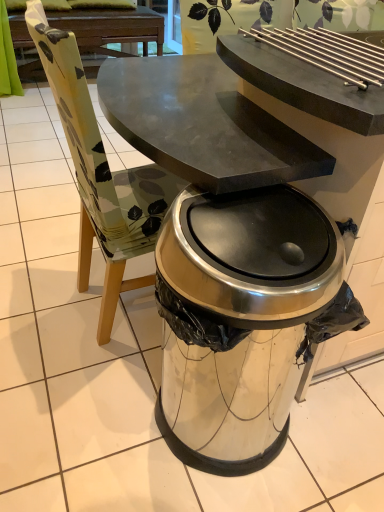
Question: Is the position of satin silver trash can at center less distant than that of dark brown wood picnic table at upper center?

Choices:
 (A) yes
 (B) no

Answer: (A)

Question: Does satin silver trash can at center have a lesser width compared to dark brown wood picnic table at upper center?

Choices:
 (A) yes
 (B) no

Answer: (A)

Question: From the image's perspective, is satin silver trash can at center under dark brown wood picnic table at upper center?

Choices:
 (A) yes
 (B) no

Answer: (A)

Question: Is dark brown wood picnic table at upper center inside satin silver trash can at center?

Choices:
 (A) yes
 (B) no

Answer: (B)

Question: Can we say satin silver trash can at center lies outside dark brown wood picnic table at upper center?

Choices:
 (A) yes
 (B) no

Answer: (A)

Question: Is satin silver trash can at center not near dark brown wood picnic table at upper center?

Choices:
 (A) no
 (B) yes

Answer: (B)

Question: Considering the relative positions of dark brown wood picnic table at upper center and satin silver trash can at center in the image provided, is dark brown wood picnic table at upper center in front of satin silver trash can at center?

Choices:
 (A) yes
 (B) no

Answer: (B)

Question: Is dark brown wood picnic table at upper center thinner than satin silver trash can at center?

Choices:
 (A) no
 (B) yes

Answer: (A)

Question: From a real-world perspective, is dark brown wood picnic table at upper center located higher than satin silver trash can at center?

Choices:
 (A) yes
 (B) no

Answer: (B)

Question: Is dark brown wood picnic table at upper center bigger than satin silver trash can at center?

Choices:
 (A) no
 (B) yes

Answer: (B)

Question: Is dark brown wood picnic table at upper center smaller than satin silver trash can at center?

Choices:
 (A) yes
 (B) no

Answer: (B)

Question: Does dark brown wood picnic table at upper center have a greater width compared to satin silver trash can at center?

Choices:
 (A) yes
 (B) no

Answer: (A)

Question: Relative to dark brown wood picnic table at upper center, is satin silver trash can at center in front or behind?

Choices:
 (A) front
 (B) behind

Answer: (A)